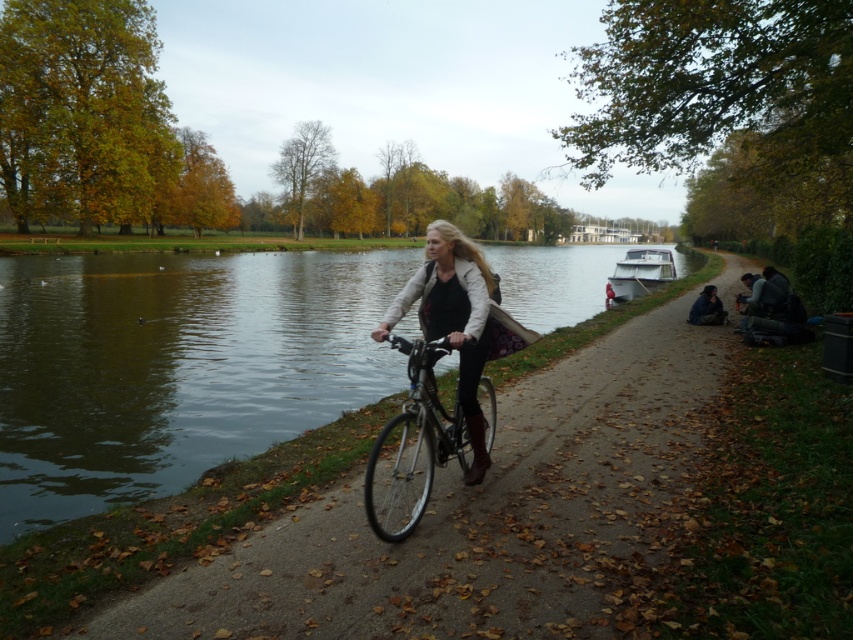
You are a photographer planning to capture the clear water at center and the white glossy boat at right in a single shot. Based on their positions, which object will appear larger in the photo?

The clear water at center will appear larger in the photo because it is much taller than the white glossy boat at right.

You are standing at the point labeled point [614,269] and want to walk to the point labeled point [456,445]. Which direction should you move in to get closer to your destination?

You should move towards the direction of the point labeled point [456,445] since it is closer to the viewer than point [614,269]. Moving towards the viewer would bring you closer to your destination.